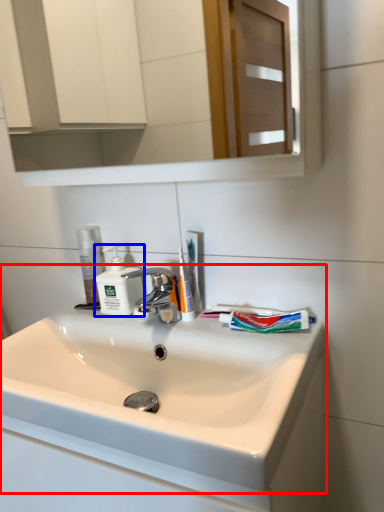
Question: Which of the following is the farthest to the observer, sink (highlighted by a red box) or soap dispenser (highlighted by a blue box)?

Choices:
 (A) sink
 (B) soap dispenser

Answer: (B)